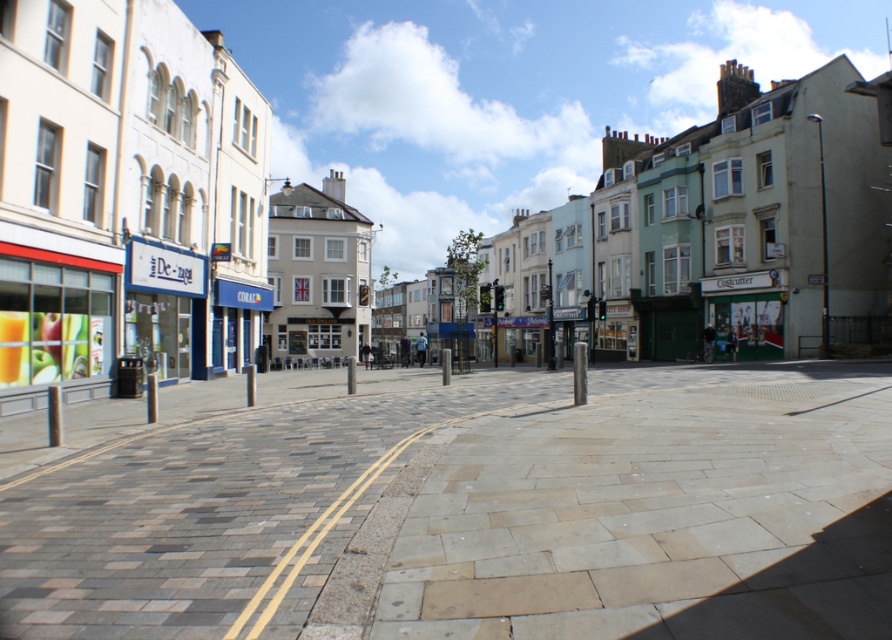
You are standing at the point marked as point (461, 506) in the image. What type of surface are you standing on?

You are standing on paved stone pavement at center.

You are standing on the street looking at the scene. There is a paved stone pavement at center and a matte white building at center. Which one is closer to you?

The paved stone pavement at center is closer to the viewer than the matte white building at center.